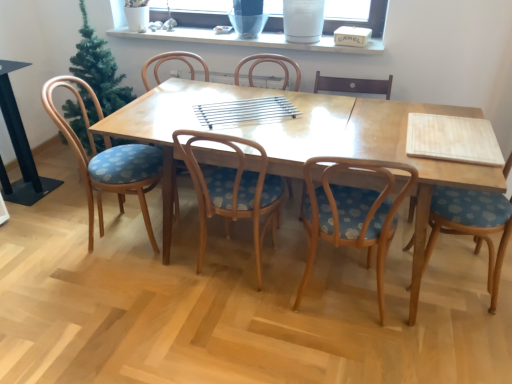
The height and width of the screenshot is (384, 512). Find the location of `empty space that is in between wooden chair with blue floral cushion at left, acting as the first chair starting from the left, and wooden chair with blue cushion at center, marked as the third chair in a left-to-right arrangement`. empty space that is in between wooden chair with blue floral cushion at left, acting as the first chair starting from the left, and wooden chair with blue cushion at center, marked as the third chair in a left-to-right arrangement is located at coordinates (177, 263).